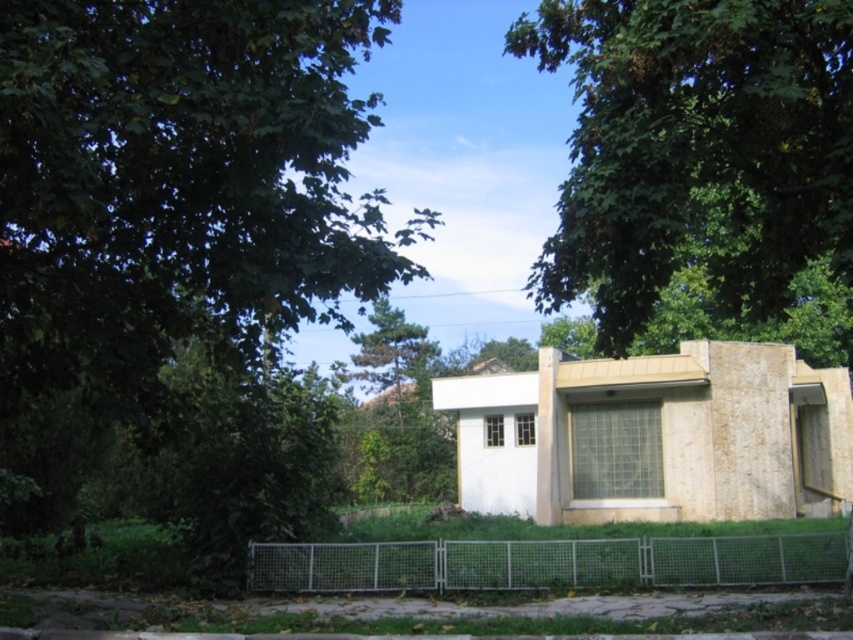
You are a landscape architect designing a pathway between the green leafy tree at upper center and the metallic wire mesh fence at lower center. What is the minimum length the pathway should be to ensure it reaches both points?

The minimum length the pathway should be is 7.81 meters to ensure it reaches both the green leafy tree at upper center and the metallic wire mesh fence at lower center.

You are a delivery person trying to deliver a package to the building. You see the green leafy tree at upper center and the metallic wire mesh fence at lower center. Which object is closer to the building?

The metallic wire mesh fence at lower center is closer to the building because the green leafy tree at upper center is in front of it, meaning the tree is between the building and the fence.

In the scene shown: You are standing in front of the suburban building and want to see the view beyond the metallic wire mesh fence at lower center. Is the green leafy tree at upper center blocking your view of the area beyond the fence?

The green leafy tree at upper center is located above the metallic wire mesh fence at lower center, so it is not blocking the view beyond the fence since it is positioned higher up.